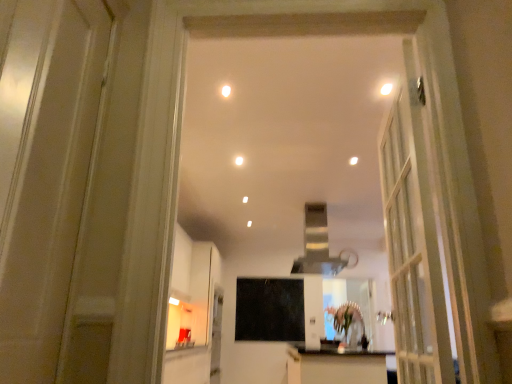
Question: From the image's perspective, is clear glass mirror at center on white glossy door at left?

Choices:
 (A) yes
 (B) no

Answer: (B)

Question: Is clear glass mirror at center positioned far away from white glossy door at left?

Choices:
 (A) yes
 (B) no

Answer: (A)

Question: From a real-world perspective, is clear glass mirror at center beneath white glossy door at left?

Choices:
 (A) no
 (B) yes

Answer: (B)

Question: From the image's perspective, would you say clear glass mirror at center is shown under white glossy door at left?

Choices:
 (A) no
 (B) yes

Answer: (B)

Question: Does clear glass mirror at center touch white glossy door at left?

Choices:
 (A) yes
 (B) no

Answer: (B)

Question: From the image's perspective, is silver metallic exhaust hood at center positioned above or below white glossy cabinet at lower center?

Choices:
 (A) below
 (B) above

Answer: (B)

Question: Which is correct: silver metallic exhaust hood at center is inside white glossy cabinet at lower center, or outside of it?

Choices:
 (A) inside
 (B) outside

Answer: (B)

Question: Is silver metallic exhaust hood at center in front of or behind white glossy cabinet at lower center in the image?

Choices:
 (A) behind
 (B) front

Answer: (A)

Question: Is point (335, 274) closer or farther from the camera than point (315, 360)?

Choices:
 (A) closer
 (B) farther

Answer: (B)

Question: In terms of size, does clear glass mirror at center appear bigger or smaller than white glossy light fixture at upper center, the 2th lighting from the right?

Choices:
 (A) small
 (B) big

Answer: (B)

Question: Relative to white glossy light fixture at upper center, marked as the first lighting in a left-to-right arrangement, is clear glass mirror at center in front or behind?

Choices:
 (A) behind
 (B) front

Answer: (A)

Question: Is point (338, 284) positioned closer to the camera than point (226, 92)?

Choices:
 (A) closer
 (B) farther

Answer: (B)

Question: From a real-world perspective, is clear glass mirror at center positioned above or below white glossy light fixture at upper center, the 2th lighting from the right?

Choices:
 (A) above
 (B) below

Answer: (B)

Question: Choose the correct answer: Is green matte flower at center inside clear glass mirror at center or outside it?

Choices:
 (A) outside
 (B) inside

Answer: (A)

Question: Looking at the image, does green matte flower at center seem bigger or smaller compared to clear glass mirror at center?

Choices:
 (A) small
 (B) big

Answer: (A)